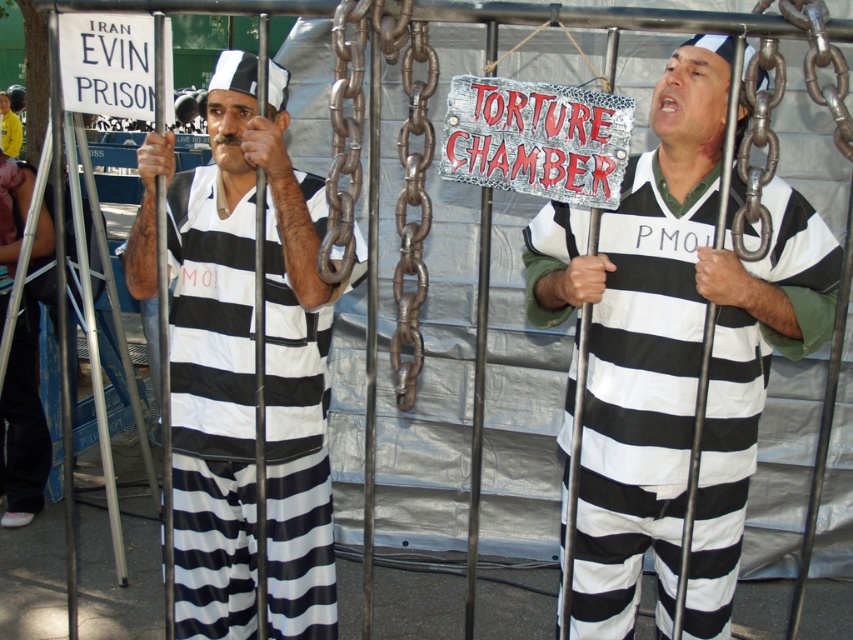
Can you confirm if matte black striped jumpsuit at left is shorter than rusty metal chain at center?

No.

You are a GUI agent. You are given a task and a screenshot of the screen. Output one action in this format:
    pyautogui.click(x=<x>, y=<y>)
    Task: Click on the matte black striped jumpsuit at left
    This screenshot has width=853, height=640.
    Given the screenshot: What is the action you would take?
    pyautogui.click(x=244, y=369)

Which is in front, point (187, 305) or point (427, 164)?

Positioned in front is point (427, 164).

This screenshot has height=640, width=853. What are the coordinates of `matte black striped jumpsuit at left` in the screenshot? It's located at (244, 369).

Between matte black striped jumpsuit at center and matte black striped jumpsuit at left, which one is positioned higher?

matte black striped jumpsuit at center

From the picture: Who is taller, matte black striped jumpsuit at center or matte black striped jumpsuit at left?

matte black striped jumpsuit at left

Image resolution: width=853 pixels, height=640 pixels. Describe the element at coordinates (674, 353) in the screenshot. I see `matte black striped jumpsuit at center` at that location.

The height and width of the screenshot is (640, 853). I want to click on matte black striped jumpsuit at center, so click(674, 353).

Is point (714, 474) less distant than point (373, 42)?

That is False.

Does point (531, 253) come closer to viewer compared to point (337, 38)?

No, (531, 253) is behind (337, 38).

The width and height of the screenshot is (853, 640). Find the location of `matte black striped jumpsuit at center`. matte black striped jumpsuit at center is located at coordinates (674, 353).